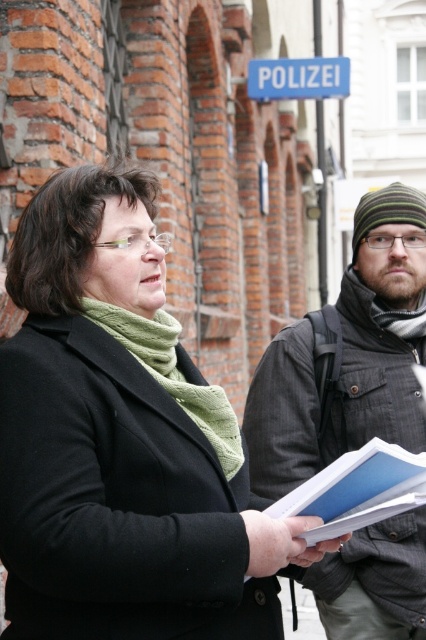
You are a photographer trying to capture a closeup of the blue paper at center. However, the black matte coat at center is blocking your view. Can you adjust your position to take the photo without moving the coat or the paper?

The black matte coat at center is above the blue paper at center, so you can lower your camera or crouch down to position it below the coat to capture the blue paper at center without moving either object.

You are a photographer setting up a tripod to take a group photo of the two people in the scene. The blue plastic sign at upper center needs to be visible in the photo, but you want to make sure the green knitted scarf at left isn t cropped out. Based on their sizes, can you position the camera so both are fully visible?

The green knitted scarf at left is shorter than the blue plastic sign at upper center. Since the scarf is shorter, positioning the camera to include the taller sign will likely also capture the scarf, so yes, both can be fully visible.